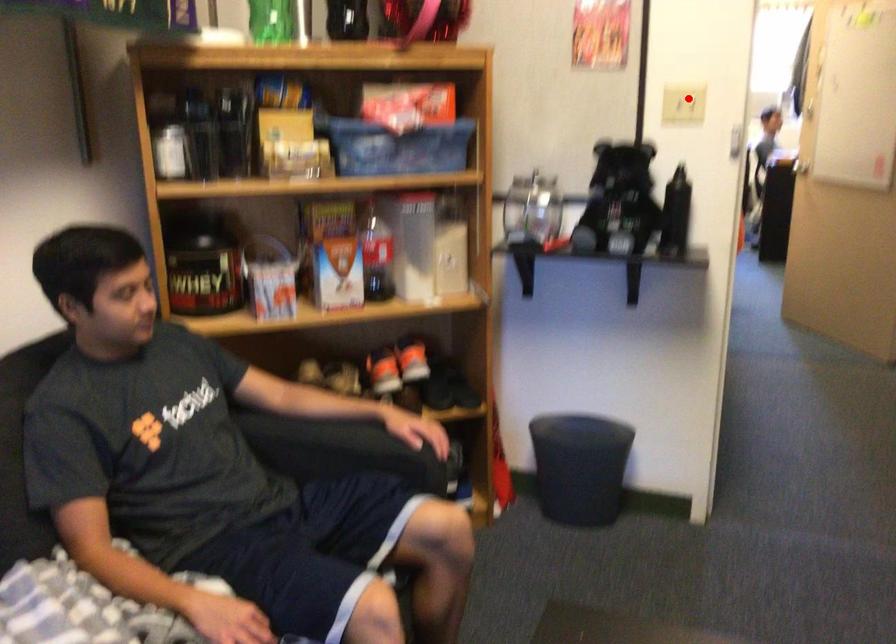
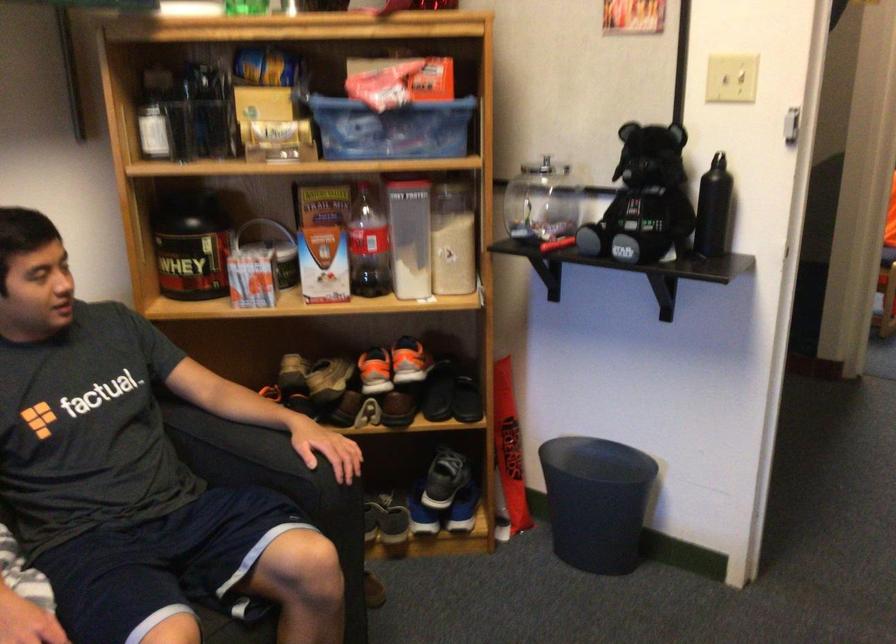
Question: A red point is marked in image1. In image2, is the corresponding 3D point closer to the camera or farther? Reply with the corresponding letter.

Choices:
 (A) The corresponding 3D point is closer.
 (B) The corresponding 3D point is farther.

Answer: (A)